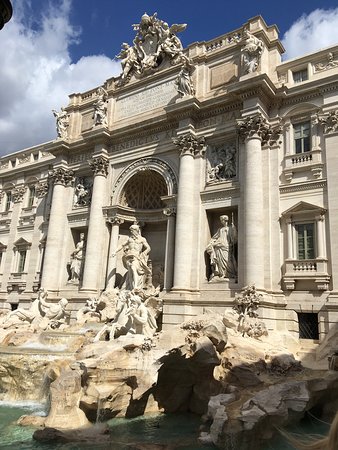
Find the location of a particular element. windows is located at coordinates (12, 163), (38, 152), (296, 76), (303, 141), (32, 197), (7, 201), (24, 261), (302, 236).